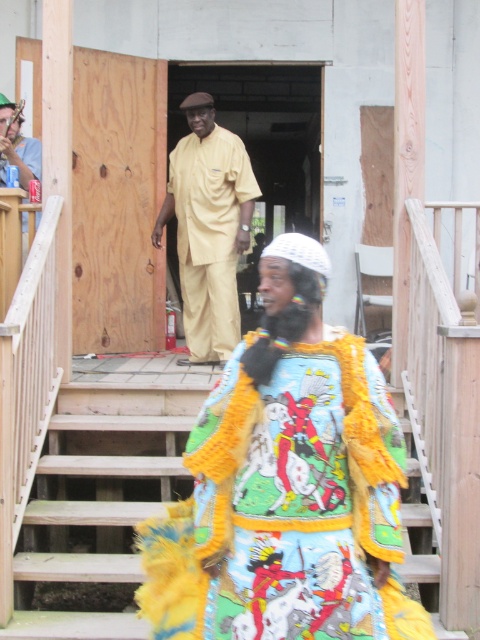
Question: Which point appears closest to the camera in this image?

Choices:
 (A) (134, 579)
 (B) (273, 308)

Answer: (B)

Question: Can you confirm if multicolored fabric costume at center is wider than wooden stairs at lower center?

Choices:
 (A) yes
 (B) no

Answer: (A)

Question: Which of the following is the farthest from the observer?

Choices:
 (A) (96, 556)
 (B) (398, 438)

Answer: (A)

Question: Which point is farther to the camera?

Choices:
 (A) (190, 292)
 (B) (165, 564)
 (C) (131, 380)

Answer: (A)

Question: Observing the image, what is the correct spatial positioning of multicolored fabric costume at center in reference to beige matte uniform at center?

Choices:
 (A) below
 (B) above

Answer: (A)

Question: In this image, where is multicolored fabric costume at center located relative to beige matte uniform at center?

Choices:
 (A) above
 (B) below

Answer: (B)